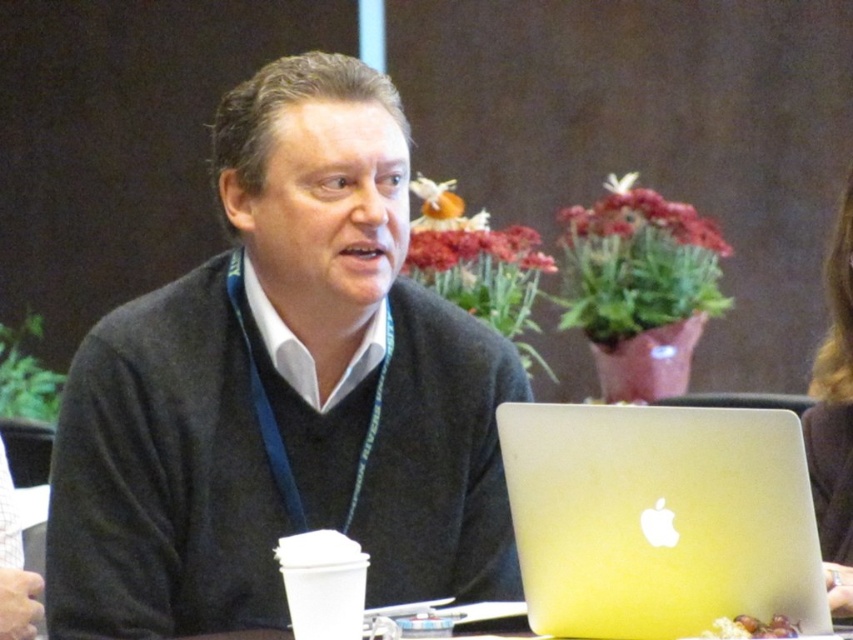
Can you confirm if dark gray sweater at center is bigger than dark brown hair at upper right?

Incorrect, dark gray sweater at center is not larger than dark brown hair at upper right.

How distant is dark gray sweater at center from dark brown hair at upper right?

A distance of 33.18 inches exists between dark gray sweater at center and dark brown hair at upper right.

Who is more forward, [338,406] or [842,365]?

Positioned in front is point [338,406].

Find the location of a particular element. The height and width of the screenshot is (640, 853). dark gray sweater at center is located at coordinates (282, 392).

Between point (392, 280) and point (613, 602), which one is positioned behind?

Positioned behind is point (392, 280).

Between dark gray sweater at center and silver metallic laptop at center, which one is positioned lower?

Positioned lower is silver metallic laptop at center.

The height and width of the screenshot is (640, 853). What do you see at coordinates (282, 392) in the screenshot?
I see `dark gray sweater at center` at bounding box center [282, 392].

Where is `dark gray sweater at center`? This screenshot has width=853, height=640. dark gray sweater at center is located at coordinates (282, 392).

Is point (689, 577) more distant than point (840, 420)?

That is False.

Which is in front, point (607, 541) or point (848, 262)?

Point (607, 541) is more forward.

You are a GUI agent. You are given a task and a screenshot of the screen. Output one action in this format:
    pyautogui.click(x=<x>, y=<y>)
    Task: Click on the silver metallic laptop at center
    
    Given the screenshot: What is the action you would take?
    pyautogui.click(x=660, y=518)